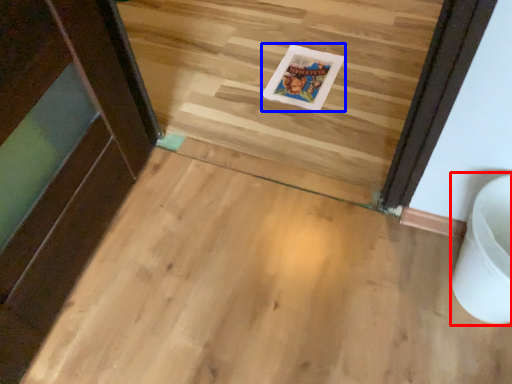
Question: Which point is further to the camera, toilet bowl (highlighted by a red box) or postcard (highlighted by a blue box)?

Choices:
 (A) toilet bowl
 (B) postcard

Answer: (B)